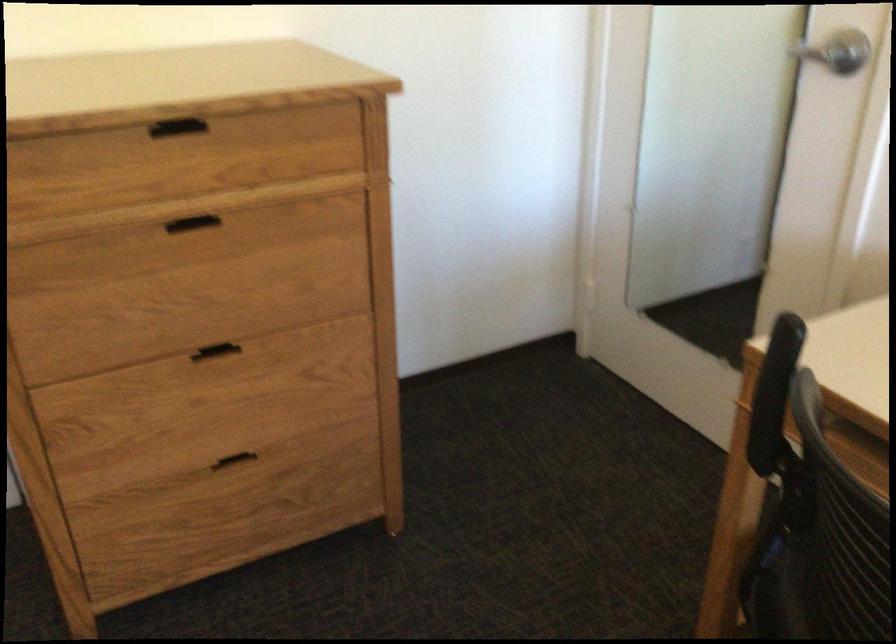
The height and width of the screenshot is (644, 896). Identify the location of silver door handle. (806, 52).